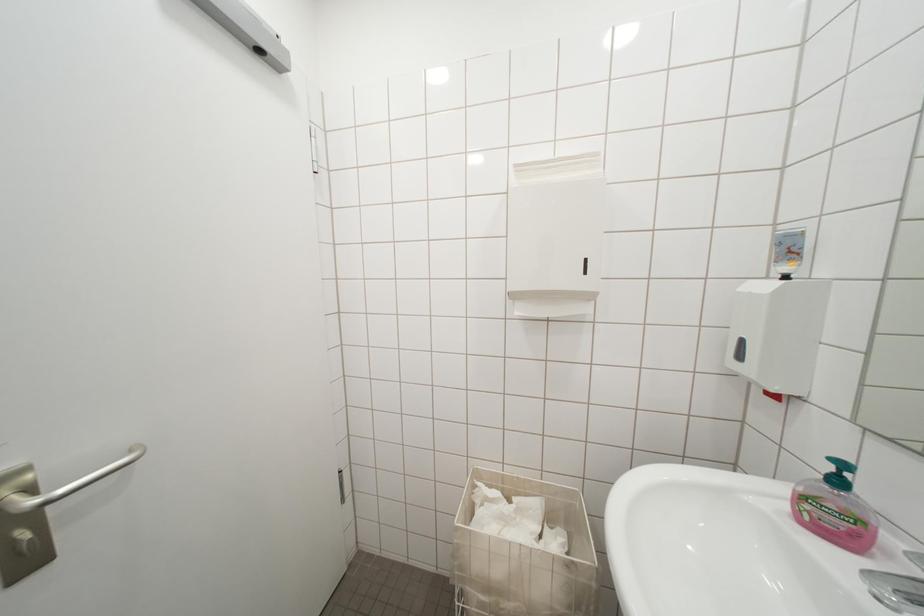
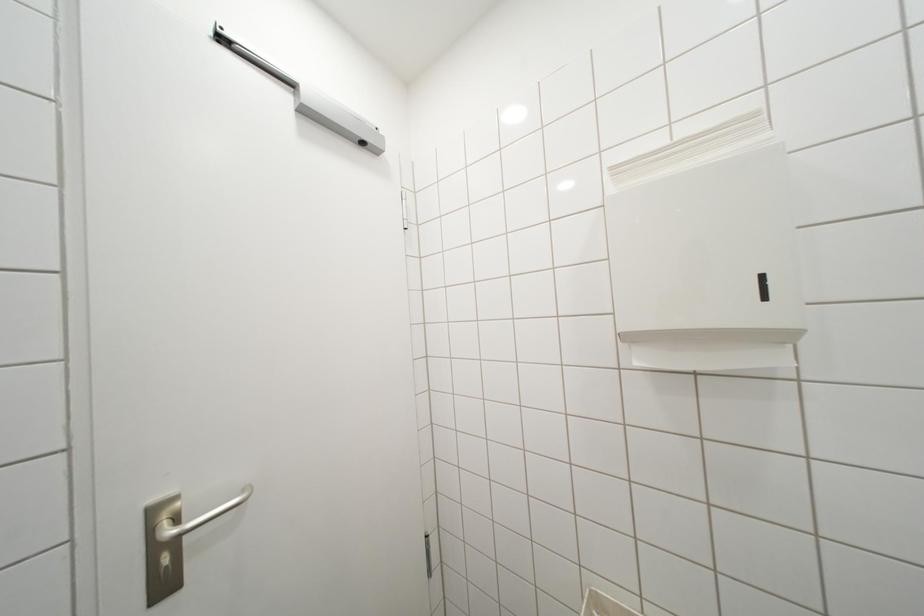
Question: The camera is either moving clockwise (left) or counter-clockwise (right) around the object. The first image is from the beginning of the video and the second image is from the end. Is the camera moving left or right when shooting the video?

Choices:
 (A) Left
 (B) Right

Answer: (B)